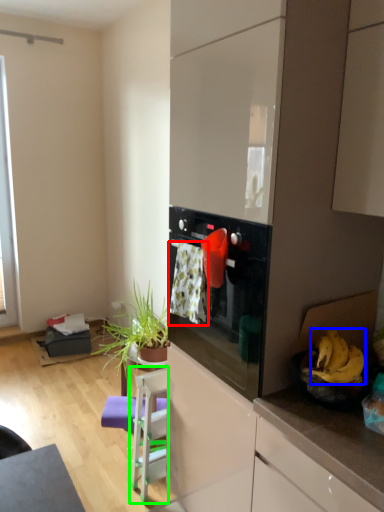
Question: Estimate the real-world distances between objects in this image. Which object is closer to laundry (highlighted by a red box), banana (highlighted by a blue box) or chair (highlighted by a green box)?

Choices:
 (A) banana
 (B) chair

Answer: (A)